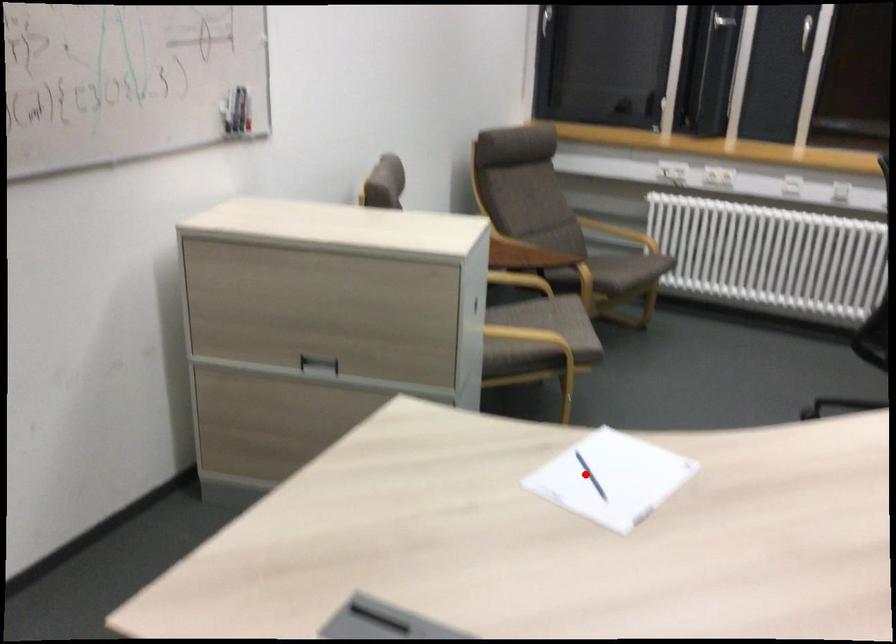
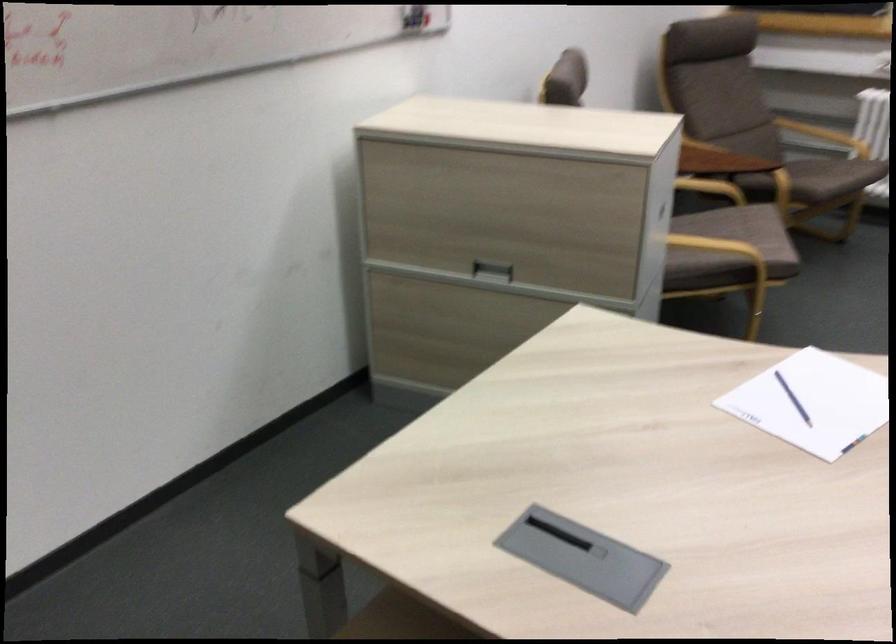
The point at the highlighted location is marked in the first image. Where is the corresponding point in the second image?

(793, 399)